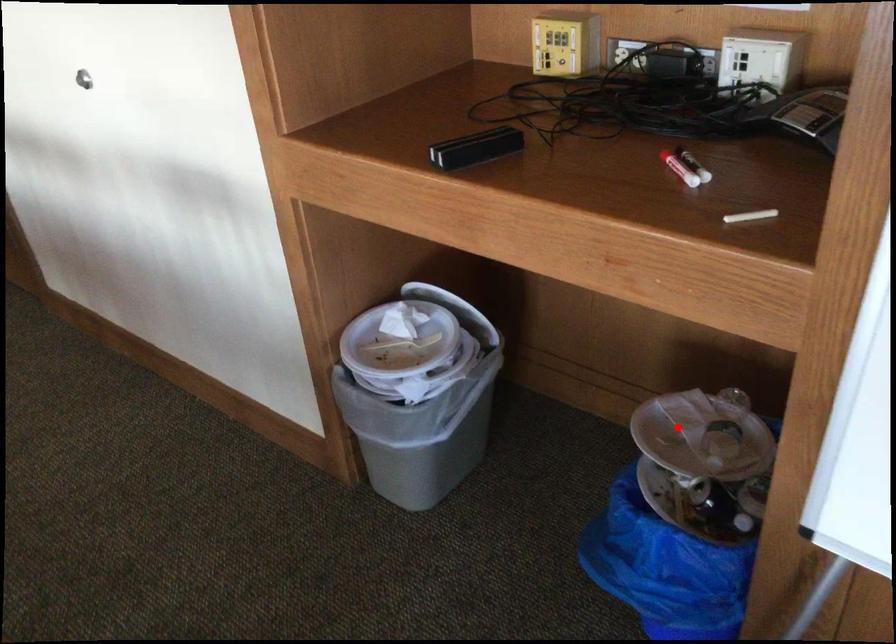
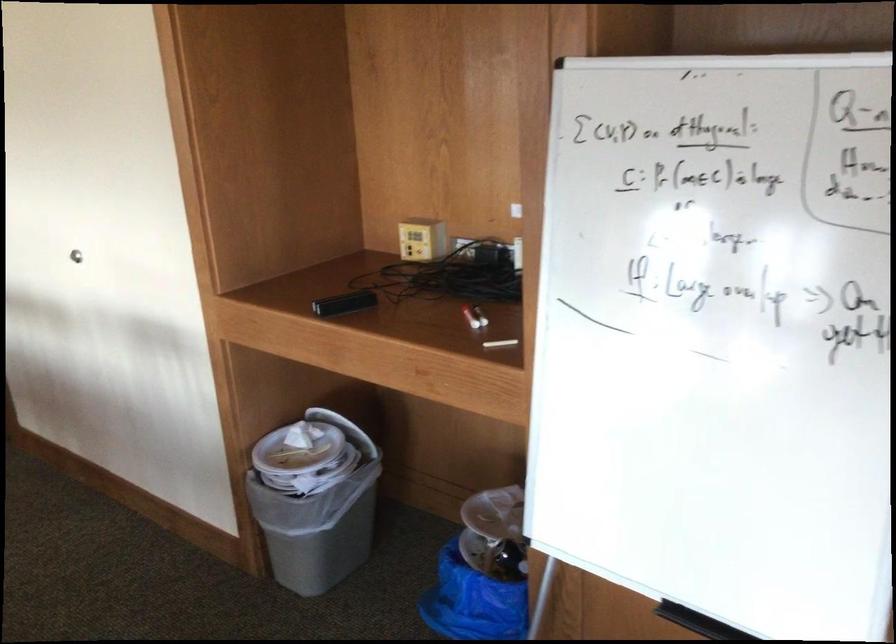
Where in the second image is the point corresponding to the highlighted location from the first image?

(495, 513)